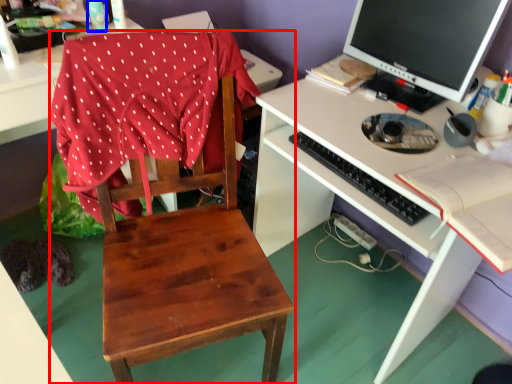
Question: Which object appears closest to the camera in this image, chair (highlighted by a red box) or bottle (highlighted by a blue box)?

Choices:
 (A) chair
 (B) bottle

Answer: (A)